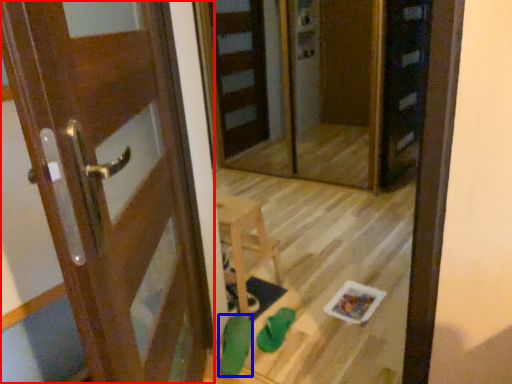
Question: Among these objects, which one is nearest to the camera, door (highlighted by a red box) or shoe (highlighted by a blue box)?

Choices:
 (A) door
 (B) shoe

Answer: (A)